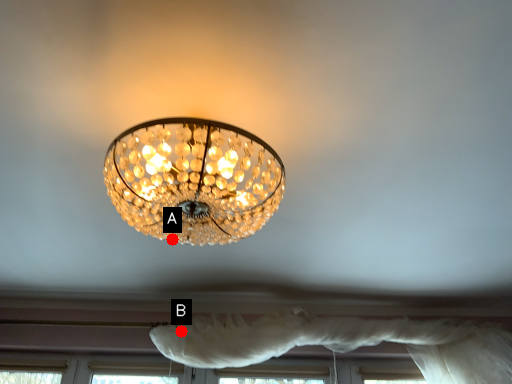
Question: Two points are circled on the image, labeled by A and B beside each circle. Which point is further to the camera?

Choices:
 (A) A is further
 (B) B is further

Answer: (B)